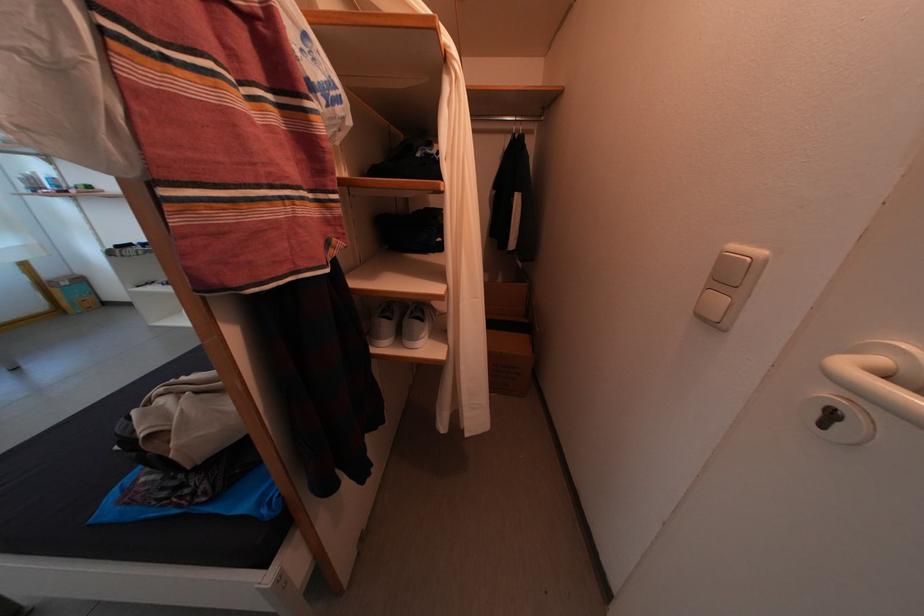
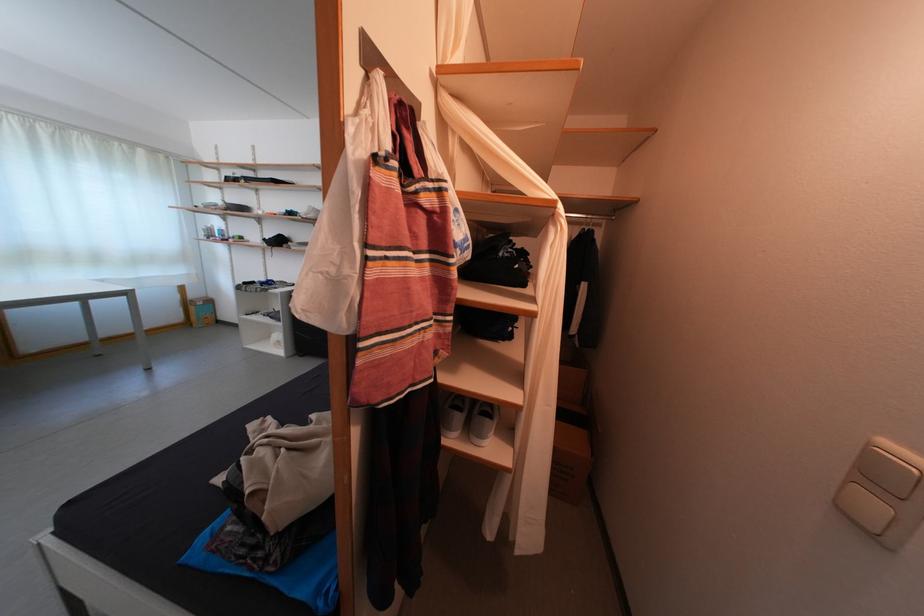
Find the pixel in the second image that matches point (55, 281) in the first image.

(201, 302)